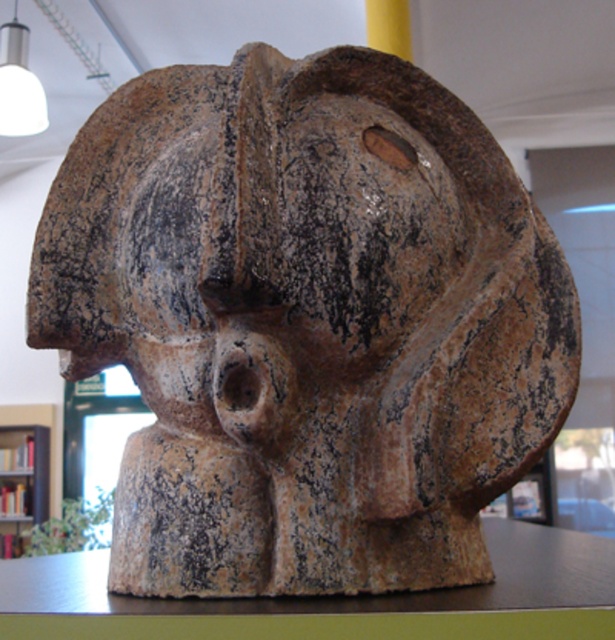
You are an interior designer planning to place a new sculpture in a room. You notice the wooden bookshelf at left and the matte white bulb at upper left. Which object is wider?

The wooden bookshelf at left is wider than the matte white bulb at upper left because the wooden bookshelf at left has a greater width as stated in the description.

You are an art curator planning to move the brown wood table at center to a new location. If you lift it and move it to the right, will the wooden bookshelf at left become visible from your current position?

The brown wood table at center is positioned over the wooden bookshelf at left, so moving it to the right would reveal the wooden bookshelf at left that was previously obstructed.

You are an interior designer assessing the placement of the brown wood table at center and the matte white bulb at upper left in the museum. Which object is closer to the ceiling?

The matte white bulb at upper left is closer to the ceiling because it is taller than the brown wood table at center.